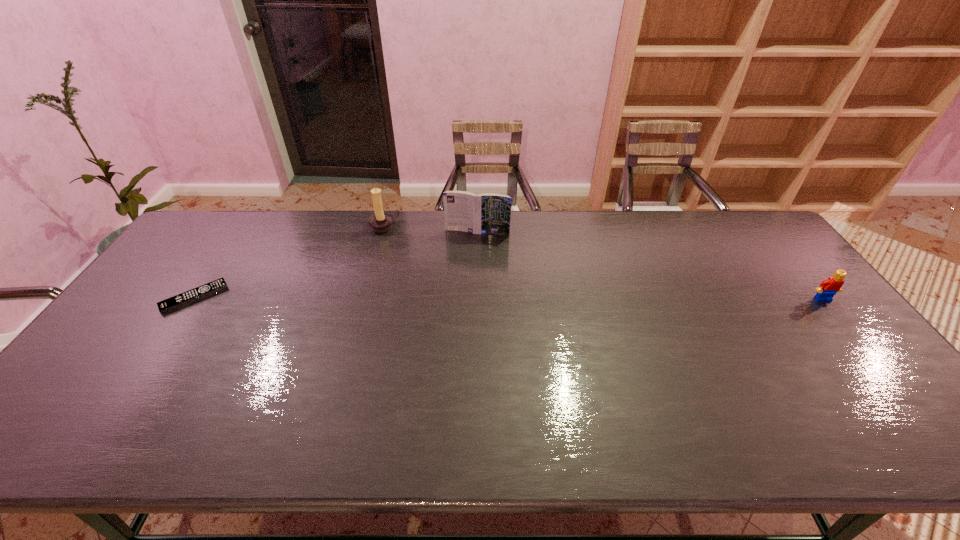
Where is `vacant space on the desktop that is between the remote control and the rightmost object and is positioned on the front cover of the book`? The image size is (960, 540). vacant space on the desktop that is between the remote control and the rightmost object and is positioned on the front cover of the book is located at coordinates (460, 298).

Find the location of `free space on the desktop that is between the leftmost object and the rightmost object and is positioned on the wick of the second object from left to right`. free space on the desktop that is between the leftmost object and the rightmost object and is positioned on the wick of the second object from left to right is located at coordinates (x=464, y=298).